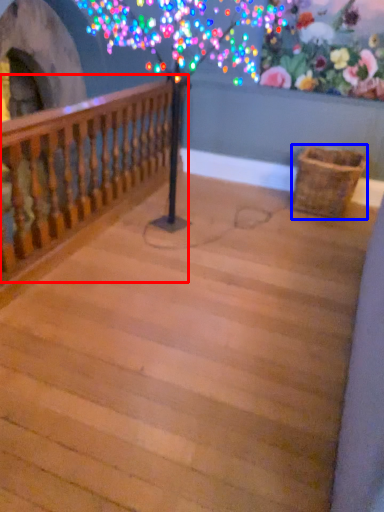
Question: Which object is further to the camera taking this photo, rail (highlighted by a red box) or basket (highlighted by a blue box)?

Choices:
 (A) rail
 (B) basket

Answer: (B)